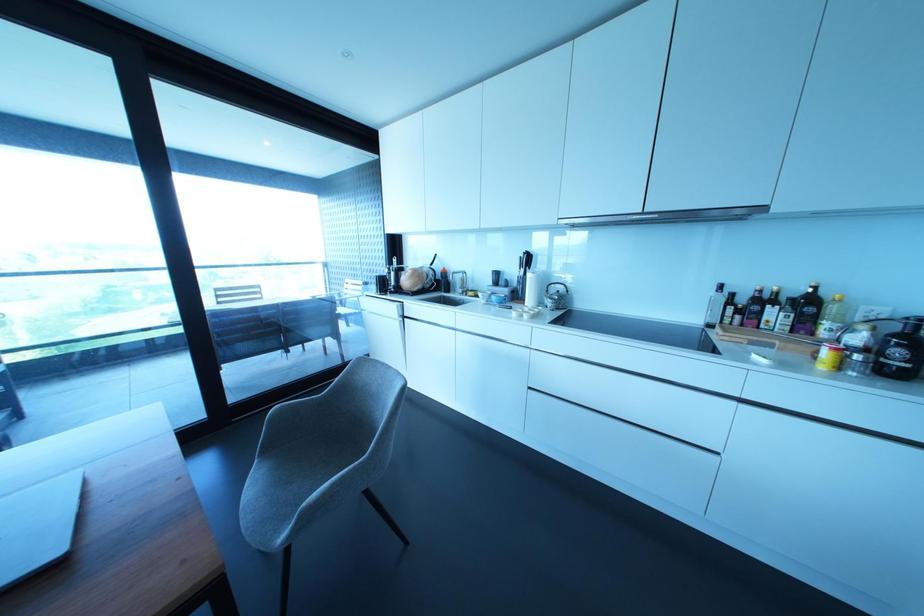
Identify the location of faucet handle. This screenshot has width=924, height=616. (555, 294).